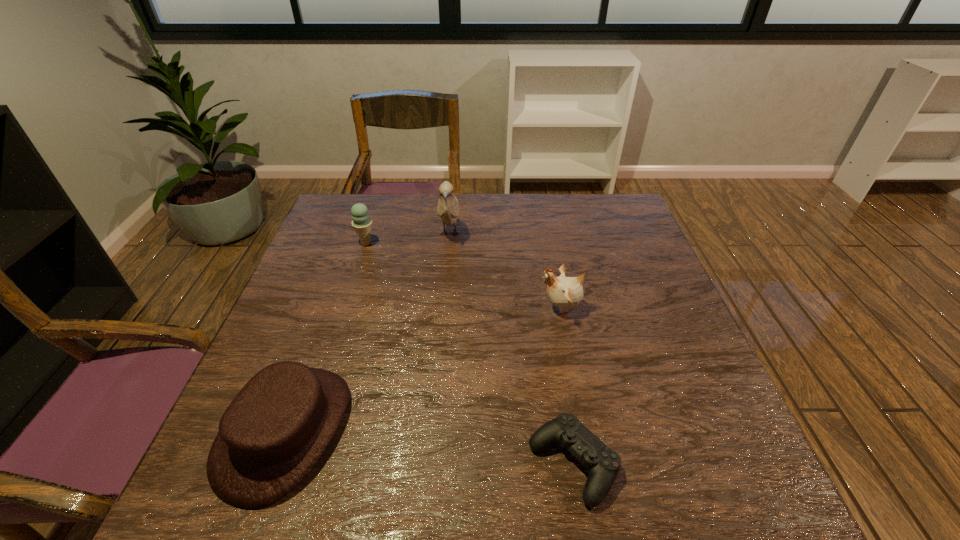
At what (x,y) coordinates should I click in order to perform the action: click on the left bird. Please return your answer as a coordinate pair (x, y). Looking at the image, I should click on (448, 206).

Identify the location of the tallest object. (448, 206).

Find the location of `ice cream`. ice cream is located at coordinates (361, 223).

This screenshot has height=540, width=960. What are the coordinates of `the third nearest object` in the screenshot? It's located at (564, 292).

Locate an element on the screen. This screenshot has height=540, width=960. the right bird is located at coordinates (564, 292).

Identify the location of hat. Image resolution: width=960 pixels, height=540 pixels. (273, 433).

What are the coordinates of `the shortest object` in the screenshot? It's located at (603, 464).

This screenshot has width=960, height=540. In order to click on vacant space positioned 0.390m at the beak of the farther bird in this screenshot , I will do `click(439, 360)`.

Identify the location of blank space located on the front of the ice cream. This screenshot has width=960, height=540. (359, 265).

Locate an element on the screen. The width and height of the screenshot is (960, 540). vacant space located at the beak of the nearer bird is located at coordinates (502, 308).